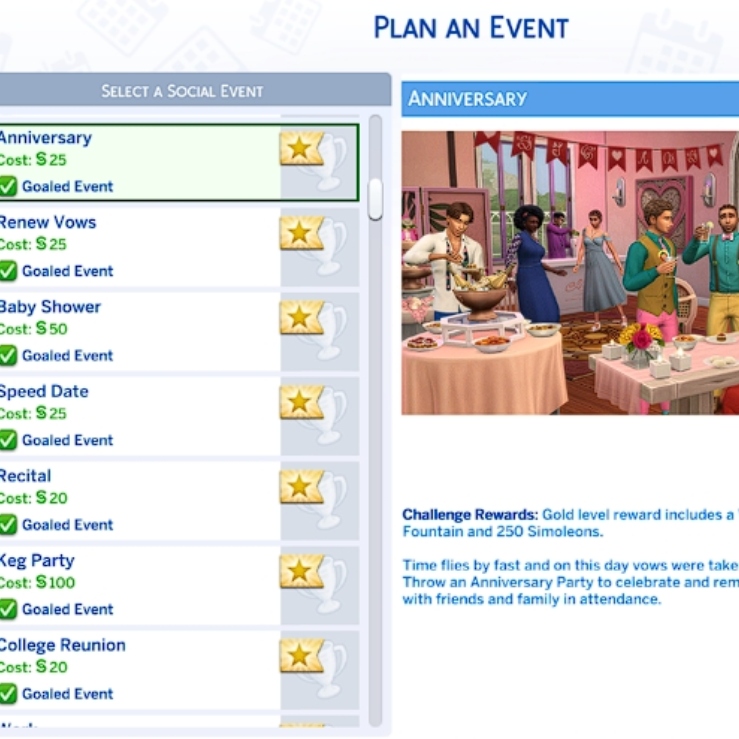
This screenshot has width=739, height=739. What are the coordinates of `punch bowl on left pink table` in the screenshot? It's located at (480, 293).